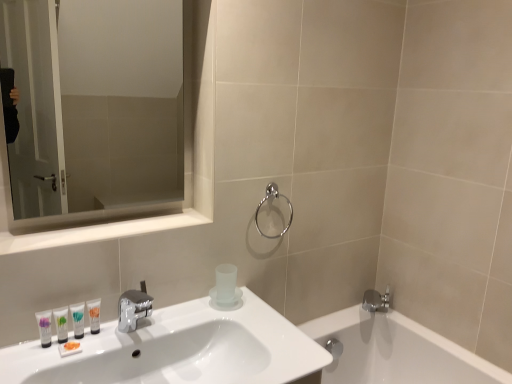
Question: From a real-world perspective, is white glossy mirror at upper left physically located above or below polished chrome towel ring at upper center?

Choices:
 (A) above
 (B) below

Answer: (B)

Question: In the image, is white glossy mirror at upper left positioned in front of or behind polished chrome towel ring at upper center?

Choices:
 (A) front
 (B) behind

Answer: (A)

Question: Based on their relative distances, which object is nearer to the polished chrome towel ring at upper center?

Choices:
 (A) silver metallic faucet at lower right
 (B) white glossy sink at lower left
 (C) translucent plastic tube at sink, arranged as the fourth mouthwash when viewed from the left
 (D) clear glass mirror at upper left
 (E) white glossy mirror at upper left

Answer: (E)

Question: Based on their relative distances, which object is nearer to the silver metallic faucet at lower right?

Choices:
 (A) matte white tube at lower left, marked as the fourth mouthwash in a right-to-left arrangement
 (B) polished chrome towel ring at upper center
 (C) clear glass mirror at upper left
 (D) translucent plastic tube at sink, the 1th mouthwash from the right
 (E) white glossy tube at lower left, the third mouthwash when ordered from left to right

Answer: (B)